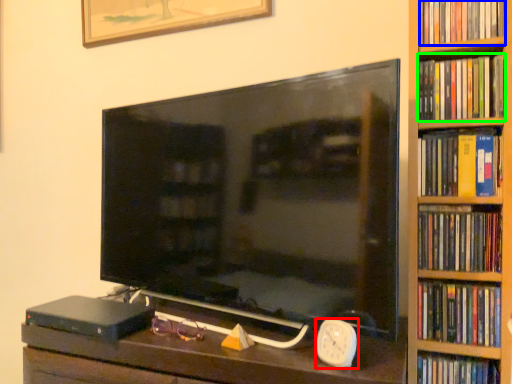
Question: Estimate the real-world distances between objects in this image. Which object is farther from clock (highlighted by a red box), book (highlighted by a blue box) or book (highlighted by a green box)?

Choices:
 (A) book
 (B) book

Answer: (A)